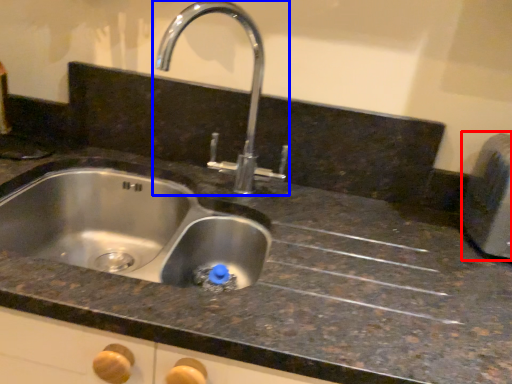
Question: Which of the following is the farthest to the observer, appliance (highlighted by a red box) or tap (highlighted by a blue box)?

Choices:
 (A) appliance
 (B) tap

Answer: (A)